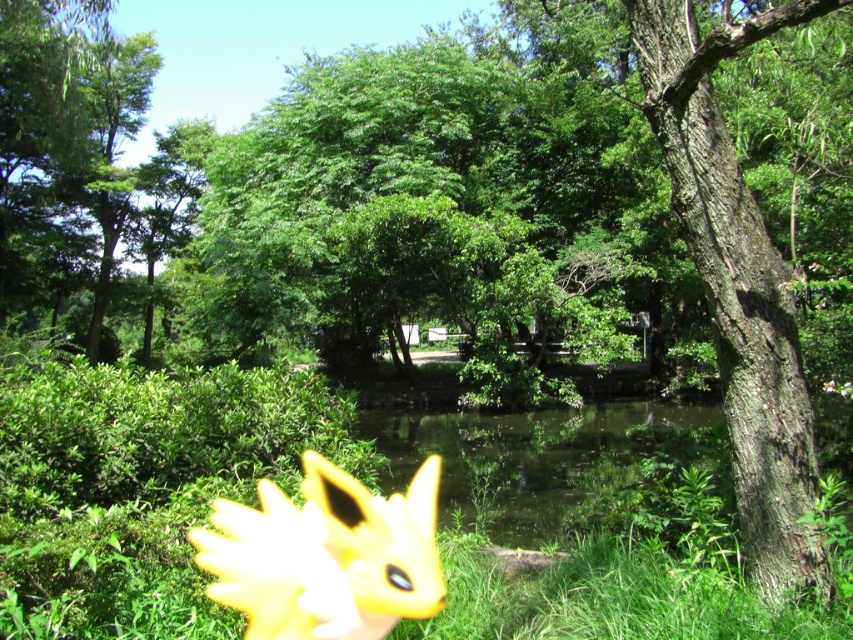
You are standing in the serene natural scene described. You notice a point marked at coordinates (738, 284). What does this point indicate?

The point at coordinates (738, 284) marks the location of smooth brown bark at the right side of the tree trunk.

You are planning to place a new decorative item in the scene. The yellow plush toy at lower left and the clear water at center are already present. Which object would be more suitable for placing a small pebble next to, considering their sizes?

The yellow plush toy at lower left has a smaller size compared to clear water at center, so placing a small pebble next to the yellow plush toy at lower left would be more appropriate due to their similar scale.